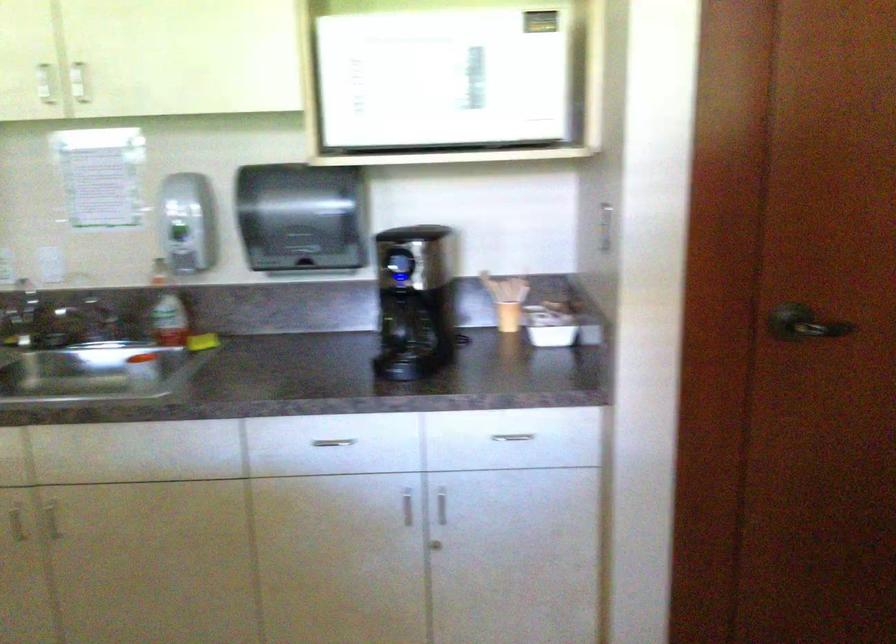
Find the location of `dish soap bottle`. dish soap bottle is located at coordinates (168, 321).